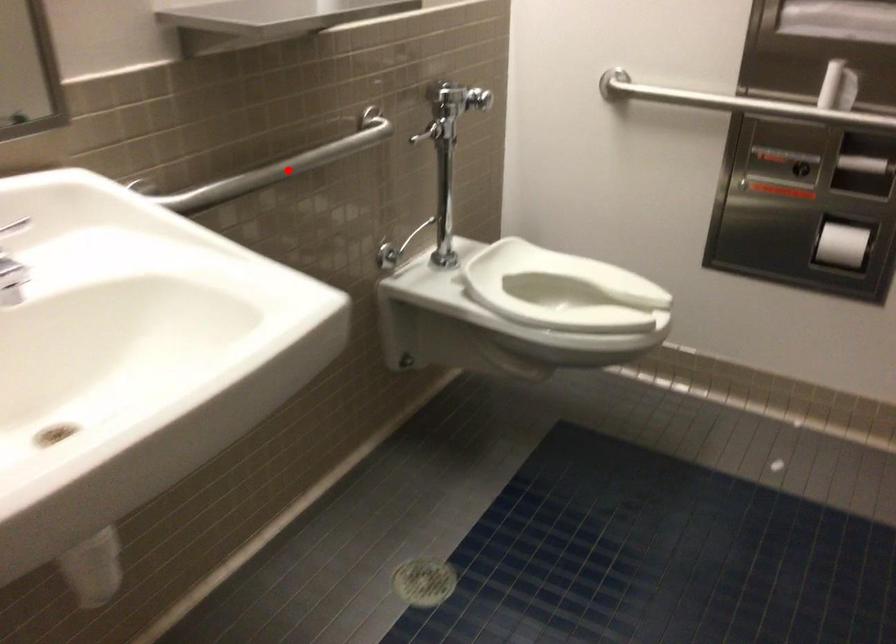
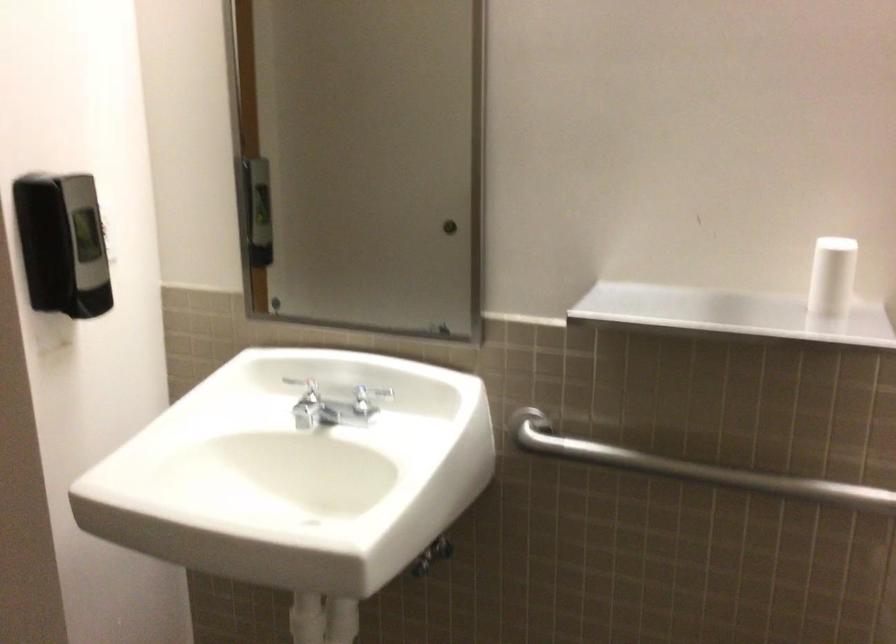
Question: I am providing you with two images of the same scene from different viewpoints. In image1, a red point is highlighted. Considering the same 3D point in image2, which of the following is correct?

Choices:
 (A) It is closer
 (B) It is farther

Answer: (A)